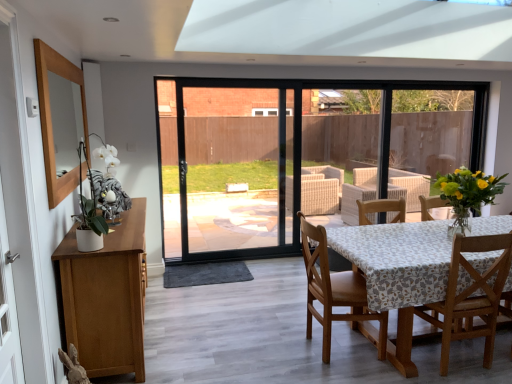
You are a GUI agent. You are given a task and a screenshot of the screen. Output one action in this format:
    pyautogui.click(x=<x>, y=<y>)
    Task: Click on the yellow fabric vase at right, the 1th floral arrangement positioned from the back
    
    Given the screenshot: What is the action you would take?
    pyautogui.click(x=469, y=189)

The image size is (512, 384). Describe the element at coordinates (469, 189) in the screenshot. I see `yellow fabric vase at right, the 1th floral arrangement positioned from the back` at that location.

The image size is (512, 384). I want to click on wooden chair at center, which is the 1th chair from left to right, so click(336, 293).

Identify the location of white ceramic vase at left, placed as the second floral arrangement when sorted from right to left. (103, 196).

Describe the element at coordinates (21, 207) in the screenshot. This screenshot has width=512, height=384. I see `wooden mirror at left` at that location.

Identify the location of wooden chair at lower right, placed as the second chair when sorted from left to right. (471, 297).

Identify the location of yellow fabric vase at right, the 1th floral arrangement positioned from the back. This screenshot has width=512, height=384. (469, 189).

Does yellow fabric vase at right, the 1th floral arrangement positioned from the back, lie behind wooden mirror at left?

Yes, it is.

Locate an element on the screen. This screenshot has height=384, width=512. barn door above the yellow fabric vase at right, acting as the 1th floral arrangement starting from the right (from a real-world perspective) is located at coordinates 21,207.

Between yellow fabric vase at right, acting as the 1th floral arrangement starting from the right, and wooden mirror at left, which one has larger size?

Bigger between the two is wooden mirror at left.

From a real-world perspective, is yellow fabric vase at right, the 2th floral arrangement positioned from the front, beneath wooden mirror at left?

Correct, in the physical world, yellow fabric vase at right, the 2th floral arrangement positioned from the front, is lower than wooden mirror at left.

Does wooden mirror at left appear on the left side of wooden chair at lower right, placed as the second chair when sorted from left to right?

Indeed, wooden mirror at left is positioned on the left side of wooden chair at lower right, placed as the second chair when sorted from left to right.

Considering the positions of objects wooden mirror at left and wooden chair at lower right, arranged as the 1th chair when viewed from the right, in the image provided, who is in front, wooden mirror at left or wooden chair at lower right, arranged as the 1th chair when viewed from the right,?

wooden mirror at left is in front.

Would you say wooden mirror at left is a long distance from wooden chair at lower right, placed as the second chair when sorted from left to right?

That's right, there is a large distance between wooden mirror at left and wooden chair at lower right, placed as the second chair when sorted from left to right.

Does wooden mirror at left contain wooden chair at lower right, arranged as the 1th chair when viewed from the right?

No, wooden chair at lower right, arranged as the 1th chair when viewed from the right, is located outside of wooden mirror at left.

Is white ceramic vase at left, arranged as the 1th floral arrangement when viewed from the front, further to camera compared to yellow fabric vase at right, the 2th floral arrangement positioned from the front?

No.

Is white ceramic vase at left, placed as the second floral arrangement when sorted from right to left, outside of yellow fabric vase at right, the 2th floral arrangement when ordered from left to right?

white ceramic vase at left, placed as the second floral arrangement when sorted from right to left, is positioned outside yellow fabric vase at right, the 2th floral arrangement when ordered from left to right.

Which is more to the left, white ceramic vase at left, placed as the second floral arrangement when sorted from right to left, or yellow fabric vase at right, acting as the 1th floral arrangement starting from the right?

white ceramic vase at left, placed as the second floral arrangement when sorted from right to left.

Does white ceramic vase at left, marked as the 2th floral arrangement in a back-to-front arrangement, have a lesser width compared to yellow fabric vase at right, the 2th floral arrangement when ordered from left to right?

Correct, the width of white ceramic vase at left, marked as the 2th floral arrangement in a back-to-front arrangement, is less than that of yellow fabric vase at right, the 2th floral arrangement when ordered from left to right.

Considering the sizes of objects wooden chair at center, the 2th chair from the right, and white ceramic vase at left, arranged as the 1th floral arrangement when viewed from the front, in the image provided, who is taller, wooden chair at center, the 2th chair from the right, or white ceramic vase at left, arranged as the 1th floral arrangement when viewed from the front,?

Standing taller between the two is wooden chair at center, the 2th chair from the right.

From a real-world perspective, is wooden chair at center, the 2th chair from the right, beneath white ceramic vase at left, marked as the 2th floral arrangement in a back-to-front arrangement?

Indeed, from a real-world perspective, wooden chair at center, the 2th chair from the right, is positioned beneath white ceramic vase at left, marked as the 2th floral arrangement in a back-to-front arrangement.

From the image's perspective, between wooden chair at center, the 2th chair from the right, and white ceramic vase at left, arranged as the 1th floral arrangement when viewed from the front, which one is located above?

white ceramic vase at left, arranged as the 1th floral arrangement when viewed from the front.

Considering the sizes of objects wooden chair at center, which is the 1th chair from left to right, and white ceramic vase at left, arranged as the 1th floral arrangement when viewed from the front, in the image provided, who is bigger, wooden chair at center, which is the 1th chair from left to right, or white ceramic vase at left, arranged as the 1th floral arrangement when viewed from the front,?

With larger size is wooden chair at center, which is the 1th chair from left to right.

Considering the sizes of objects wooden chair at lower right, placed as the second chair when sorted from left to right, and wooden chair at center, the 2th chair from the right, in the image provided, who is wider, wooden chair at lower right, placed as the second chair when sorted from left to right, or wooden chair at center, the 2th chair from the right,?

wooden chair at center, the 2th chair from the right.

Is the position of wooden chair at lower right, placed as the second chair when sorted from left to right, more distant than that of wooden chair at center, the 2th chair from the right?

No, wooden chair at lower right, placed as the second chair when sorted from left to right, is closer to the camera.

How different are the orientations of wooden chair at lower right, arranged as the 1th chair when viewed from the right, and wooden chair at center, the 2th chair from the right, in degrees?

They differ by 90 degrees in their facing directions.

Does wooden mirror at left lie in front of yellow fabric vase at right, the 2th floral arrangement when ordered from left to right?

Yes, it is in front of yellow fabric vase at right, the 2th floral arrangement when ordered from left to right.

Is wooden mirror at left aimed at yellow fabric vase at right, the 2th floral arrangement when ordered from left to right?

Yes.

From a real-world perspective, who is located lower, wooden mirror at left or yellow fabric vase at right, the 1th floral arrangement positioned from the back?

In real-world perspective, yellow fabric vase at right, the 1th floral arrangement positioned from the back, is lower.

Between white ceramic vase at left, which appears as the first floral arrangement when viewed from the left, and wooden mirror at left, which one appears on the left side from the viewer's perspective?

Positioned to the left is wooden mirror at left.

Is white ceramic vase at left, arranged as the 1th floral arrangement when viewed from the front, inside the boundaries of wooden mirror at left, or outside?

white ceramic vase at left, arranged as the 1th floral arrangement when viewed from the front, lies outside wooden mirror at left.

Consider the image. How many degrees apart are the facing directions of white ceramic vase at left, marked as the 2th floral arrangement in a back-to-front arrangement, and wooden mirror at left?

The facing directions of white ceramic vase at left, marked as the 2th floral arrangement in a back-to-front arrangement, and wooden mirror at left are 1.37 degrees apart.

From the image's perspective, who appears lower, white ceramic vase at left, which appears as the first floral arrangement when viewed from the left, or wooden mirror at left?

wooden mirror at left appears lower in the image.

Identify the location of floral arrangement that is the 2nd one when counting backward from the wooden mirror at left. The height and width of the screenshot is (384, 512). [469, 189].

Locate an element on the screen. This screenshot has height=384, width=512. barn door above the wooden chair at lower right, arranged as the 1th chair when viewed from the right (from a real-world perspective) is located at coordinates (21, 207).

From the image, which object appears to be farther from wooden chair at lower right, placed as the second chair when sorted from left to right, white ceramic vase at left, arranged as the 1th floral arrangement when viewed from the front, or wooden mirror at left?

The object further to wooden chair at lower right, placed as the second chair when sorted from left to right, is wooden mirror at left.

When comparing their distances from wooden chair at center, the 2th chair from the right, does wooden chair at lower right, placed as the second chair when sorted from left to right, or wooden mirror at left seem further?

wooden mirror at left is further to wooden chair at center, the 2th chair from the right.

From the image, which object appears to be nearer to white ceramic vase at left, which appears as the first floral arrangement when viewed from the left, yellow fabric vase at right, acting as the 1th floral arrangement starting from the right, or wooden chair at center, the 2th chair from the right?

The object closer to white ceramic vase at left, which appears as the first floral arrangement when viewed from the left, is wooden chair at center, the 2th chair from the right.

Looking at the image, which one is located further to yellow fabric vase at right, the 1th floral arrangement positioned from the back, wooden chair at center, the 2th chair from the right, or white ceramic vase at left, arranged as the 1th floral arrangement when viewed from the front?

The object further to yellow fabric vase at right, the 1th floral arrangement positioned from the back, is white ceramic vase at left, arranged as the 1th floral arrangement when viewed from the front.

Based on their spatial positions, is yellow fabric vase at right, the 2th floral arrangement positioned from the front, or wooden chair at lower right, arranged as the 1th chair when viewed from the right, closer to white ceramic vase at left, placed as the second floral arrangement when sorted from right to left?

Based on the image, wooden chair at lower right, arranged as the 1th chair when viewed from the right, appears to be nearer to white ceramic vase at left, placed as the second floral arrangement when sorted from right to left.

Based on their spatial positions, is wooden chair at center, which is the 1th chair from left to right, or wooden mirror at left closer to yellow fabric vase at right, acting as the 1th floral arrangement starting from the right?

wooden chair at center, which is the 1th chair from left to right.

Estimate the real-world distances between objects in this image. Which object is further from wooden chair at lower right, arranged as the 1th chair when viewed from the right, wooden chair at center, the 2th chair from the right, or white ceramic vase at left, arranged as the 1th floral arrangement when viewed from the front?

white ceramic vase at left, arranged as the 1th floral arrangement when viewed from the front, is further to wooden chair at lower right, arranged as the 1th chair when viewed from the right.

Considering their positions, is wooden mirror at left positioned closer to yellow fabric vase at right, the 1th floral arrangement positioned from the back, than wooden chair at center, which is the 1th chair from left to right?

wooden chair at center, which is the 1th chair from left to right, is positioned closer to the anchor yellow fabric vase at right, the 1th floral arrangement positioned from the back.

Where is `chair situated between white ceramic vase at left, arranged as the 1th floral arrangement when viewed from the front, and wooden chair at lower right, placed as the second chair when sorted from left to right, from left to right`? The height and width of the screenshot is (384, 512). chair situated between white ceramic vase at left, arranged as the 1th floral arrangement when viewed from the front, and wooden chair at lower right, placed as the second chair when sorted from left to right, from left to right is located at coordinates (336, 293).

The image size is (512, 384). I want to click on chair between wooden chair at center, which is the 1th chair from left to right, and yellow fabric vase at right, the 2th floral arrangement positioned from the front, in the horizontal direction, so click(471, 297).

Identify the location of floral arrangement between wooden mirror at left and wooden chair at center, the 2th chair from the right, in the horizontal direction. The width and height of the screenshot is (512, 384). (103, 196).

The image size is (512, 384). Find the location of `floral arrangement located between wooden mirror at left and yellow fabric vase at right, the 2th floral arrangement positioned from the front, in the left-right direction`. floral arrangement located between wooden mirror at left and yellow fabric vase at right, the 2th floral arrangement positioned from the front, in the left-right direction is located at coordinates (103, 196).